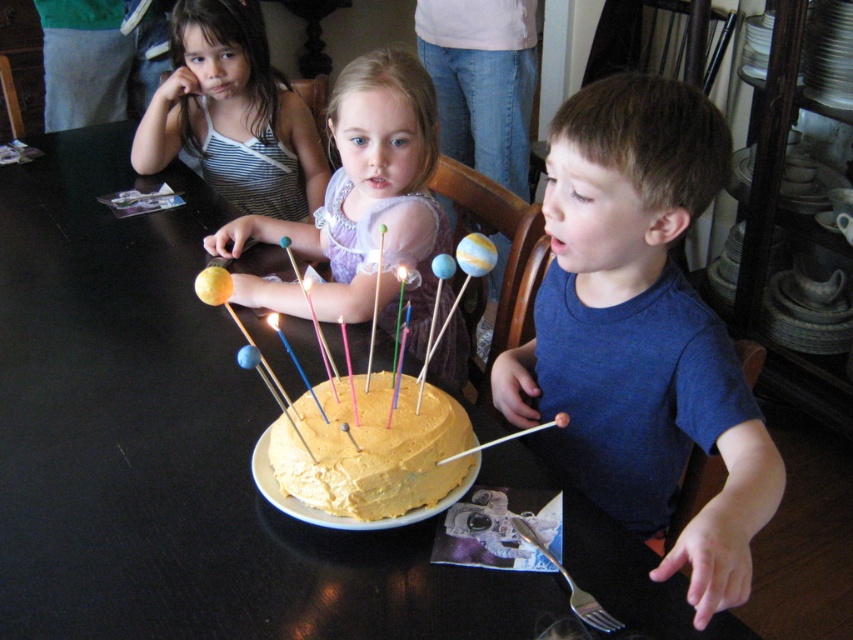
Question: Which point is farther from the camera taking this photo?

Choices:
 (A) (705, 609)
 (B) (236, 134)
 (C) (498, 433)

Answer: (B)

Question: Can you confirm if blue cotton shirt at center is smaller than striped fabric dress at upper left?

Choices:
 (A) no
 (B) yes

Answer: (A)

Question: Can you confirm if black glossy table at center is positioned to the left of striped fabric dress at upper left?

Choices:
 (A) yes
 (B) no

Answer: (B)

Question: Which object appears closest to the camera in this image?

Choices:
 (A) matte purple dress at center
 (B) blue cotton shirt at center
 (C) striped fabric dress at upper left
 (D) black glossy table at center

Answer: (B)

Question: Among these objects, which one is farthest from the camera?

Choices:
 (A) striped fabric dress at upper left
 (B) blue cotton shirt at center
 (C) black glossy table at center
 (D) yellow frosted cake at center

Answer: (A)

Question: Does blue cotton shirt at center appear on the left side of striped fabric dress at upper left?

Choices:
 (A) yes
 (B) no

Answer: (B)